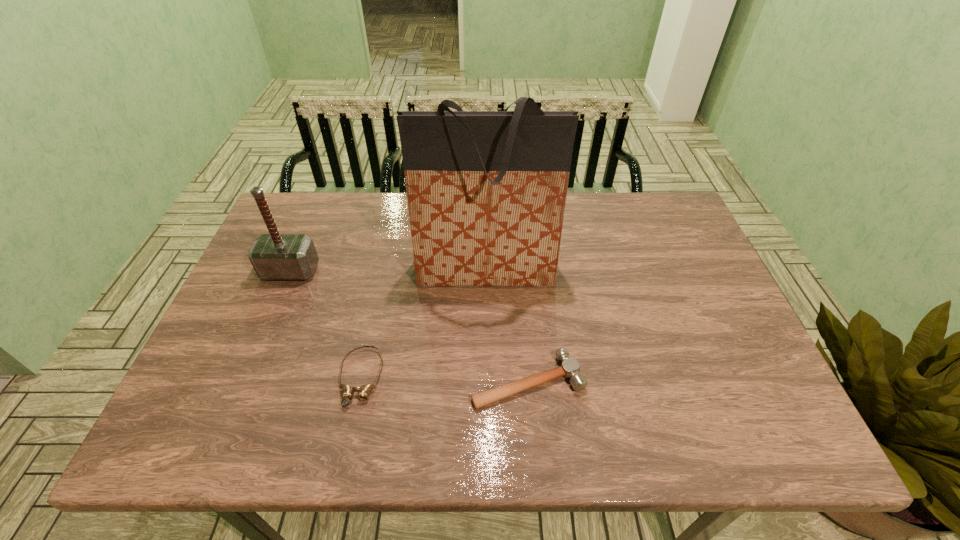
The image size is (960, 540). I want to click on the tallest object, so click(x=486, y=190).

The width and height of the screenshot is (960, 540). Find the location of `the left hammer`. the left hammer is located at coordinates (274, 256).

Where is `the leftmost object`? Image resolution: width=960 pixels, height=540 pixels. the leftmost object is located at coordinates (274, 256).

Identify the location of the nearer hammer. Image resolution: width=960 pixels, height=540 pixels. (570, 367).

Where is `the shorter hammer`? This screenshot has height=540, width=960. the shorter hammer is located at coordinates (570, 367).

Identify the location of the shortest object. (348, 391).

Find the location of a particular element. The image size is (960, 540). the second object from left to right is located at coordinates (348, 391).

The image size is (960, 540). Identify the location of vacant space positioned 0.140m on the front-facing side of the tallest object. (487, 342).

You are a GUI agent. You are given a task and a screenshot of the screen. Output one action in this format:
    pyautogui.click(x=<x>, y=<y>)
    Task: Click on the vacant space positioned on the front of the farther hammer
    This screenshot has height=540, width=960.
    Given the screenshot: What is the action you would take?
    pyautogui.click(x=254, y=357)

Find the location of a particular element. The width and height of the screenshot is (960, 540). vacant space located on the back of the shorter hammer is located at coordinates pyautogui.click(x=521, y=305).